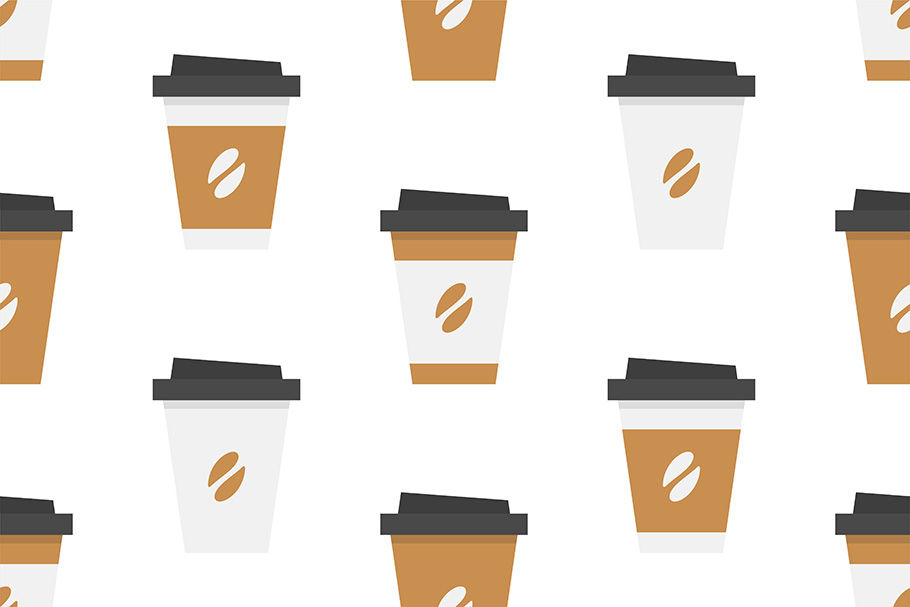
I want to click on lids of coffee cups, so point(27,215), point(17,510), point(209,382), point(437,521), point(440,209), point(668,382), point(880,206), point(870,527), point(679,82), point(220,79).